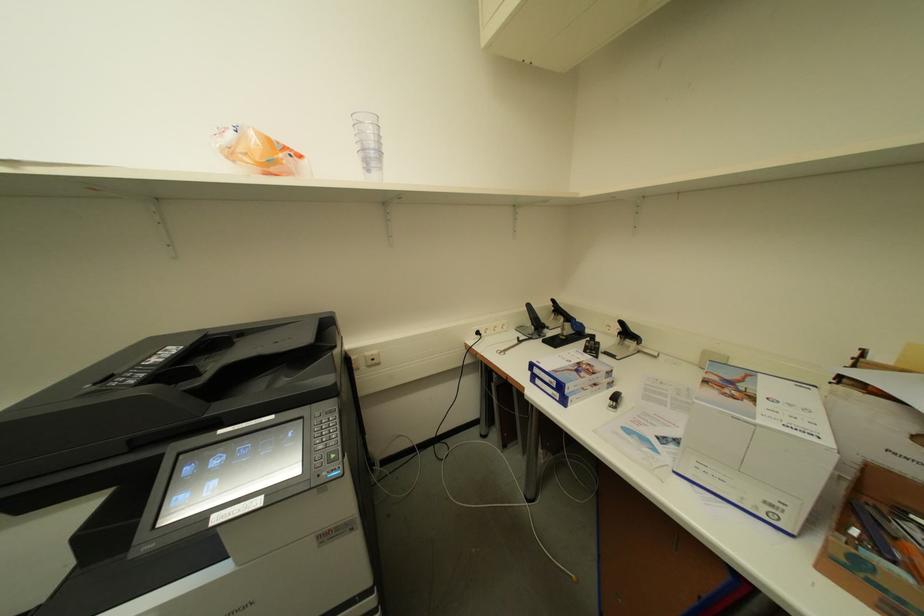
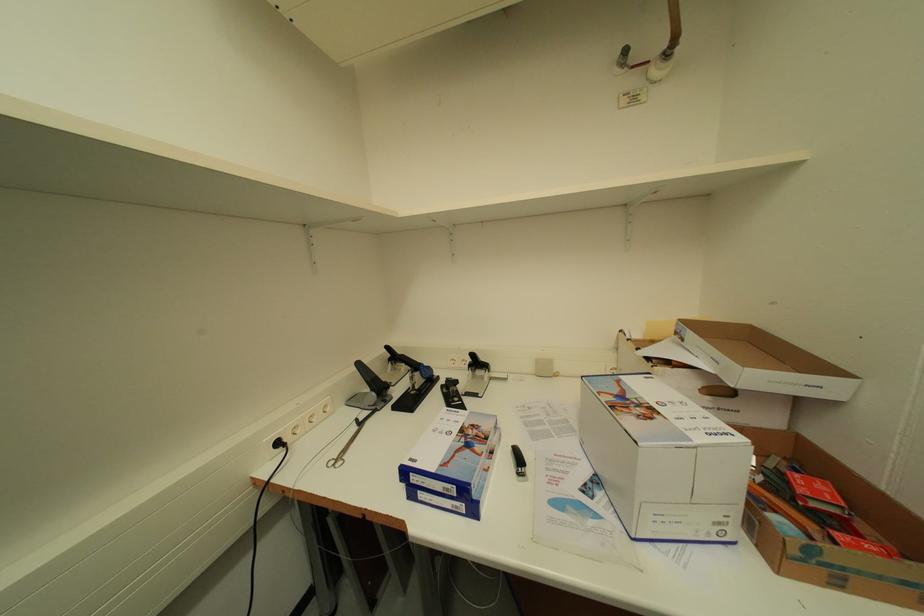
Question: How did the camera likely rotate?

Choices:
 (A) Left
 (B) Right
 (C) Up
 (D) Down

Answer: (B)